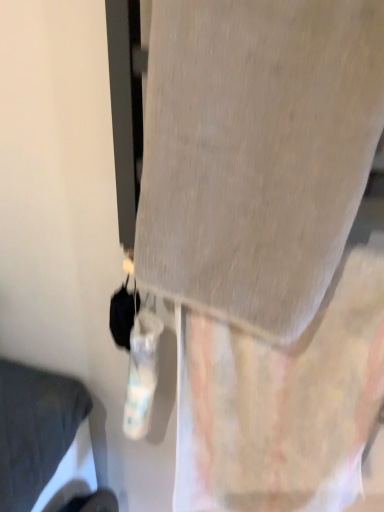
Question: Looking at their shapes, would you say textured beige curtain at center is wider or thinner than gray fabric at center?

Choices:
 (A) thin
 (B) wide

Answer: (A)

Question: From a real-world perspective, is textured beige curtain at center physically located above or below gray fabric at center?

Choices:
 (A) above
 (B) below

Answer: (B)

Question: Estimate the real-world distances between objects in this image. Which object is farther from the matte gray pillow at lower left?

Choices:
 (A) gray fabric at center
 (B) textured beige curtain at center

Answer: (A)

Question: Estimate the real-world distances between objects in this image. Which object is farther from the matte gray pillow at lower left?

Choices:
 (A) gray fabric at center
 (B) textured beige curtain at center

Answer: (A)